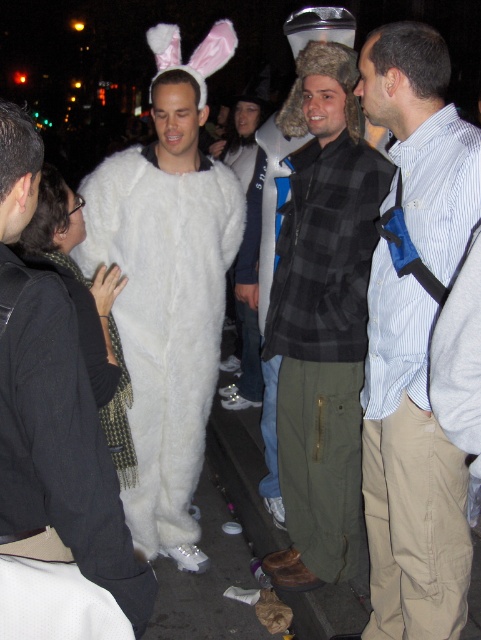
You are standing at the center of the street and want to approach the white furry costume at left. Which direction should you move to reach it?

The white furry costume at left is located at point 0.447 on the x and 0.351 on the y coordinate, so you should move to the left and slightly forward to reach it.

You are standing at the origin point of the coordinate system in the image. The black flannel shirt at center is located at point (x=323, y=316). If you want to walk directly towards the black flannel shirt at center, which direction should you move in?

To walk directly towards the black flannel shirt at center located at point (x=323, y=316), you should move northeast since the coordinates are both greater than 0.5, indicating a position above and to the right of the center point.

You are organizing a costume party and need to arrange seating based on the size of the costumes. Given the black flannel shirt at center and the white furry costume at center in the scene, which costume requires a larger seat?

The black flannel shirt at center requires a larger seat because it is larger in size than the white furry costume at center.